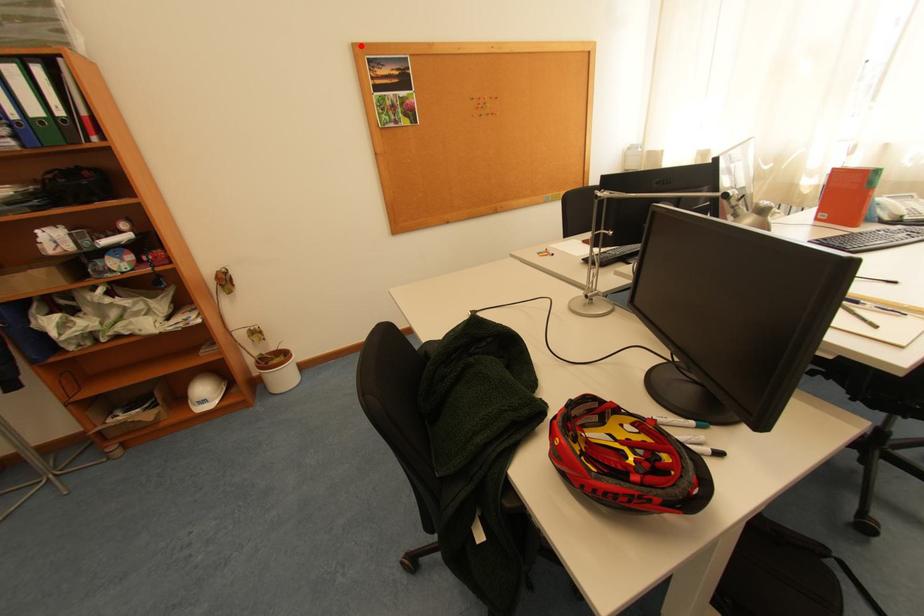
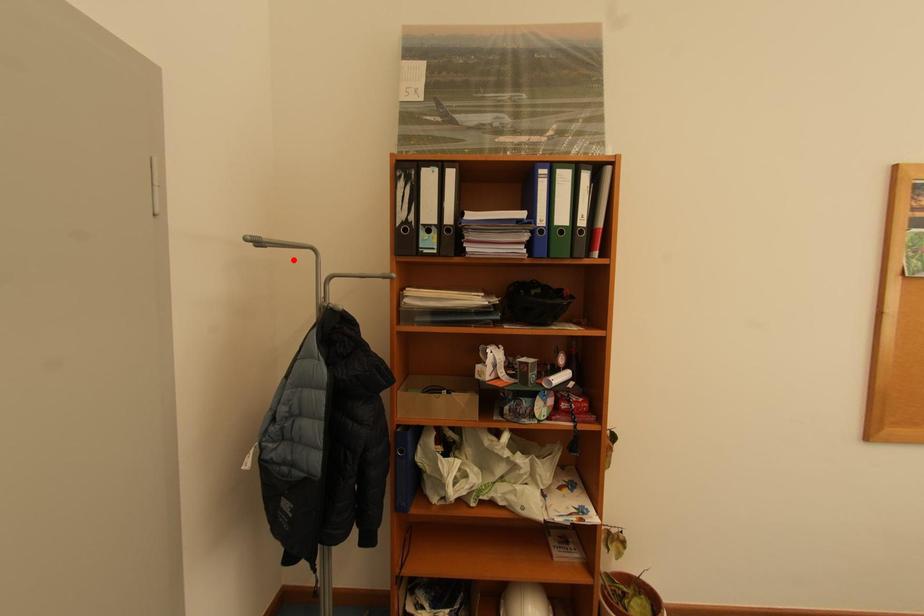
I am providing you with two images of the same scene from different viewpoints. A red point is marked on the first image and another point is marked on the second image. Do the highlighted points in image1 and image2 indicate the same real-world spot?

No